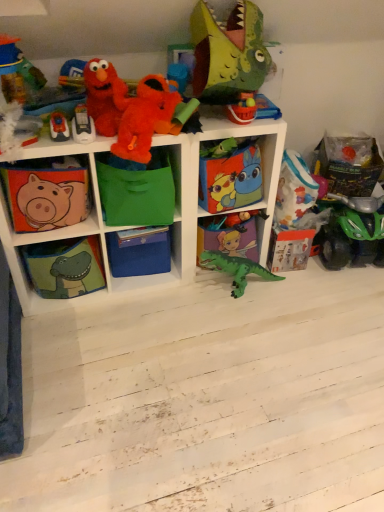
Question: From the image's perspective, does matte plastic bucket at upper center, positioned as the 4th toy in bottom-to-top order, appear lower than fluffy plush at upper left, the 3th toy when ordered from top to bottom?

Choices:
 (A) yes
 (B) no

Answer: (A)

Question: Are matte plastic bucket at upper center, which is the fourth toy in top-to-bottom order, and fluffy plush at upper left, which ranks as the 5th toy in bottom-to-top order, located far from each other?

Choices:
 (A) yes
 (B) no

Answer: (B)

Question: Can you confirm if matte plastic bucket at upper center, positioned as the 4th toy in bottom-to-top order, is bigger than fluffy plush at upper left, which ranks as the 5th toy in bottom-to-top order?

Choices:
 (A) no
 (B) yes

Answer: (A)

Question: Is fluffy plush at upper left, which ranks as the 5th toy in bottom-to-top order, surrounded by matte plastic bucket at upper center, which is the fourth toy in top-to-bottom order?

Choices:
 (A) yes
 (B) no

Answer: (B)

Question: Is matte plastic bucket at upper center, which is the fourth toy in top-to-bottom order, at the right side of fluffy plush at upper left, which ranks as the 5th toy in bottom-to-top order?

Choices:
 (A) yes
 (B) no

Answer: (A)

Question: Is point (56, 113) positioned closer to the camera than point (213, 237)?

Choices:
 (A) farther
 (B) closer

Answer: (B)

Question: From the image's perspective, is metallic silver toy at upper left, which ranks as the second toy in bottom-to-top order, positioned above or below green matte dinosaur at center, which appears as the first shelf when viewed from the right?

Choices:
 (A) below
 (B) above

Answer: (B)

Question: Is metallic silver toy at upper left, marked as the 6th toy in a top-to-bottom arrangement, wider or thinner than green matte dinosaur at center, positioned as the fifth shelf in left-to-right order?

Choices:
 (A) wide
 (B) thin

Answer: (B)

Question: Which is correct: metallic silver toy at upper left, which ranks as the second toy in bottom-to-top order, is inside green matte dinosaur at center, which appears as the first shelf when viewed from the right, or outside of it?

Choices:
 (A) inside
 (B) outside

Answer: (B)

Question: From the image's perspective, is green fabric bag at center, which ranks as the 2th shelf in right-to-left order, positioned above or below matte fabric piggy bank at left, the fifth shelf viewed from the right?

Choices:
 (A) below
 (B) above

Answer: (B)

Question: Considering the positions of green fabric bag at center, which ranks as the 2th shelf in right-to-left order, and matte fabric piggy bank at left, which ranks as the first shelf in left-to-right order, in the image, is green fabric bag at center, which ranks as the 2th shelf in right-to-left order, taller or shorter than matte fabric piggy bank at left, which ranks as the first shelf in left-to-right order,?

Choices:
 (A) short
 (B) tall

Answer: (B)

Question: In terms of size, does green fabric bag at center, which ranks as the 2th shelf in right-to-left order, appear bigger or smaller than matte fabric piggy bank at left, the fifth shelf viewed from the right?

Choices:
 (A) big
 (B) small

Answer: (A)

Question: Would you say green fabric bag at center, which ranks as the 2th shelf in right-to-left order, is inside or outside matte fabric piggy bank at left, which ranks as the first shelf in left-to-right order?

Choices:
 (A) outside
 (B) inside

Answer: (A)

Question: In terms of width, does orange plush toy at upper center, positioned as the sixth toy in bottom-to-top order, look wider or thinner when compared to green plastic dinosaur at center, placed as the seventh toy when sorted from top to bottom?

Choices:
 (A) thin
 (B) wide

Answer: (B)

Question: Would you say orange plush toy at upper center, positioned as the sixth toy in bottom-to-top order, is to the left or to the right of green plastic dinosaur at center, placed as the seventh toy when sorted from top to bottom, in the picture?

Choices:
 (A) right
 (B) left

Answer: (B)